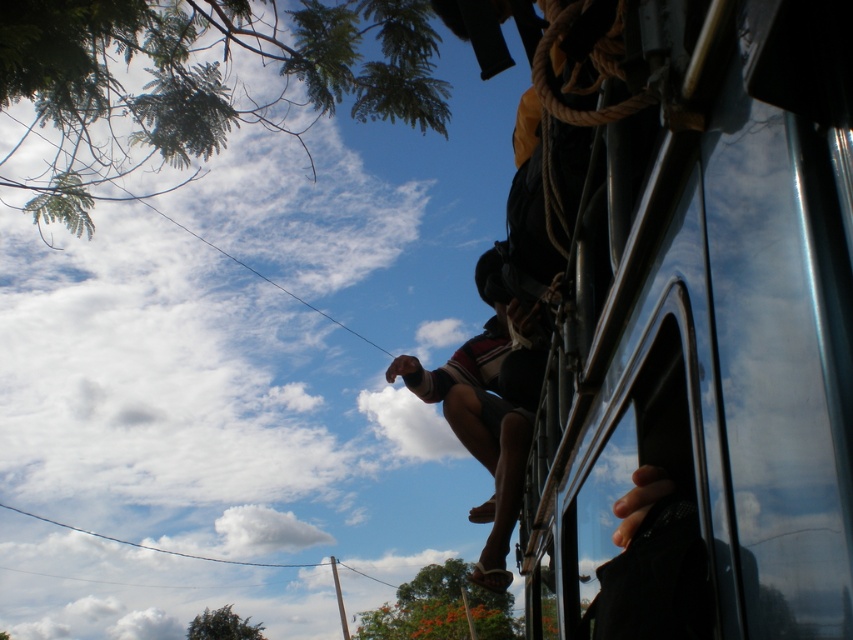
From the picture: You are standing at the center of the image. Where is the metallic silver bus at upper right located in relation to your position?

The metallic silver bus at upper right is located at point [711,316] relative to the center of the image.

You are a passenger inside the metallic silver bus at upper right and want to see the person with dark red fabric shorts at center outside. Where should you look relative to your position inside the bus?

The metallic silver bus at upper right is located above the dark red fabric shorts at center, so you should look downward from your position inside the bus to see the person.